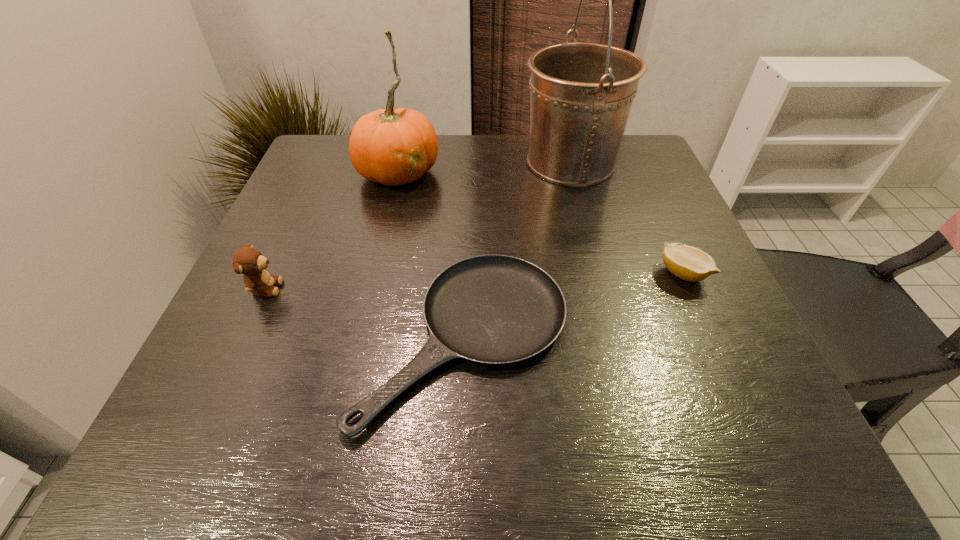
Where is `blank area located on the back of the frying pan`? blank area located on the back of the frying pan is located at coordinates (468, 234).

You are a GUI agent. You are given a task and a screenshot of the screen. Output one action in this format:
    pyautogui.click(x=<x>, y=<y>)
    Task: Click on the bucket at the far edge
    The height and width of the screenshot is (540, 960).
    Given the screenshot: What is the action you would take?
    pyautogui.click(x=581, y=93)

Find the location of a particular element. The height and width of the screenshot is (540, 960). pumpkin that is positioned at the far edge is located at coordinates (393, 147).

This screenshot has width=960, height=540. Find the location of `object located at the near edge`. object located at the near edge is located at coordinates (494, 309).

Where is `pumpkin that is positioned at the left edge`? This screenshot has width=960, height=540. pumpkin that is positioned at the left edge is located at coordinates (393, 147).

Locate an element on the screen. The image size is (960, 540). teddy bear at the left edge is located at coordinates (252, 264).

This screenshot has width=960, height=540. Identify the location of bucket present at the right edge. [581, 93].

The image size is (960, 540). In order to click on lemon present at the right edge in this screenshot , I will do `click(689, 263)`.

Find the location of a particular element. object that is at the far left corner is located at coordinates (393, 147).

Locate an element on the screen. This screenshot has width=960, height=540. object that is at the far right corner is located at coordinates (581, 93).